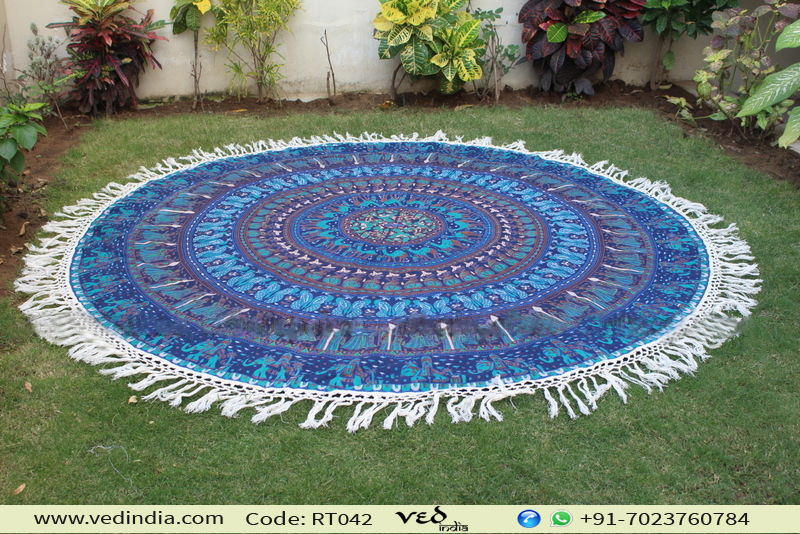
The image size is (800, 534). Identify the location of fringe on rug. (465, 406).